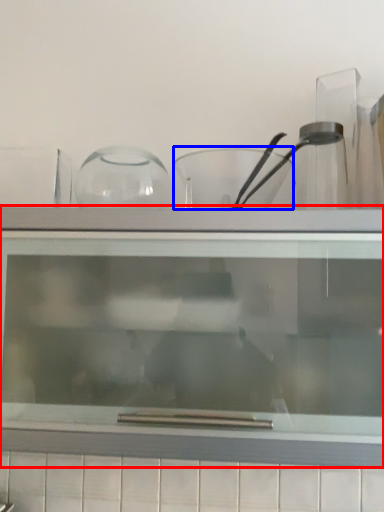
Question: Which object appears closest to the camera in this image, shelf (highlighted by a red box) or bowl (highlighted by a blue box)?

Choices:
 (A) shelf
 (B) bowl

Answer: (A)